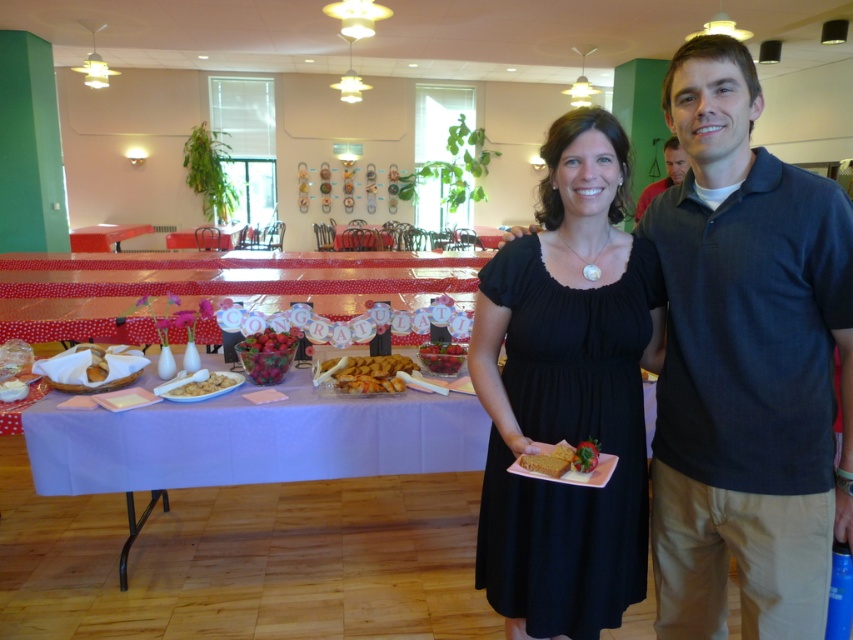
Which of these two, red glossy strawberries at center or golden brown cake at center, stands taller?

Standing taller between the two is red glossy strawberries at center.

Based on the photo, how far apart are red glossy strawberries at center and golden brown cake at center?

A distance of 1.26 meters exists between red glossy strawberries at center and golden brown cake at center.

Is point (252, 337) farther from camera compared to point (590, 440)?

Yes, it is.

Identify the location of red glossy strawberries at center. The image size is (853, 640). (267, 355).

Find the location of a particular element. The width and height of the screenshot is (853, 640). wooden table at center is located at coordinates [206, 237].

Between wooden table at center and white paper napkin at lower left, which one appears on the left side from the viewer's perspective?

Positioned to the left is wooden table at center.

Which is in front, point (231, 240) or point (22, 392)?

Point (22, 392) is in front.

Locate an element on the screen. wooden table at center is located at coordinates (206, 237).

Between golden brown cake at center and matte black shirt at center, which one appears on the left side from the viewer's perspective?

golden brown cake at center is more to the left.

Can you confirm if golden brown cake at center is shorter than matte black shirt at center?

Yes.

Where is `golden brown cake at center`? The height and width of the screenshot is (640, 853). golden brown cake at center is located at coordinates (564, 460).

Locate an element on the screen. The width and height of the screenshot is (853, 640). golden brown cake at center is located at coordinates (564, 460).